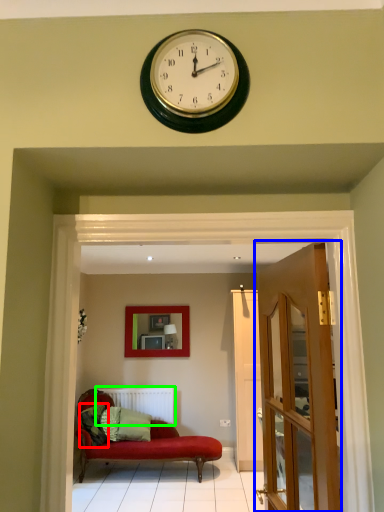
Question: Which is nearer to the pillow (highlighted by a red box)? door (highlighted by a blue box) or radiator (highlighted by a green box).

Choices:
 (A) door
 (B) radiator

Answer: (B)